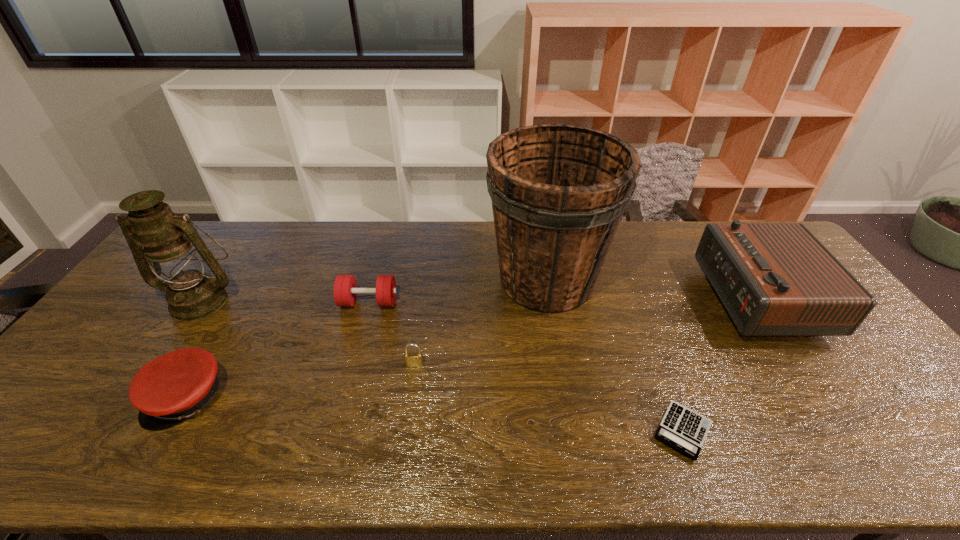
Where is `free space between the bucket and the cap`? free space between the bucket and the cap is located at coordinates (367, 339).

Find the location of a particular element. The width and height of the screenshot is (960, 540). vacant space that's between the third object from left to right and the cap is located at coordinates (277, 350).

Identify the location of vacant point located between the cap and the calculator. pos(435,414).

The image size is (960, 540). What are the coordinates of `empty location between the oil lamp and the dumbbell` in the screenshot? It's located at (285, 301).

Find the location of a particular element. The height and width of the screenshot is (540, 960). free space between the padlock and the second tallest object is located at coordinates (307, 333).

Where is `free point between the rightmost object and the oil lamp`? The width and height of the screenshot is (960, 540). free point between the rightmost object and the oil lamp is located at coordinates (479, 299).

Where is `free space between the padlock and the oil lamp`? The height and width of the screenshot is (540, 960). free space between the padlock and the oil lamp is located at coordinates (307, 333).

This screenshot has width=960, height=540. What are the coordinates of `free space between the rightmost object and the cap` in the screenshot? It's located at (472, 348).

You are a GUI agent. You are given a task and a screenshot of the screen. Output one action in this format:
    pyautogui.click(x=<x>, y=<y>)
    Task: Click on the free spot between the fourth object from right to left and the shortest object
    
    Given the screenshot: What is the action you would take?
    pyautogui.click(x=548, y=397)

The height and width of the screenshot is (540, 960). I want to click on object that is the sixth closest to the third nearest object, so click(x=774, y=279).